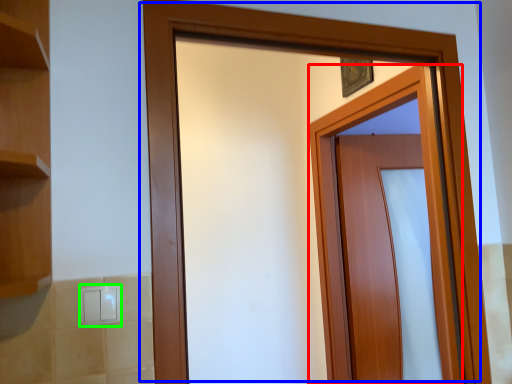
Question: Which object is the closest to the door (highlighted by a red box)? Choose among these: door (highlighted by a blue box) or light switch (highlighted by a green box).

Choices:
 (A) door
 (B) light switch

Answer: (A)